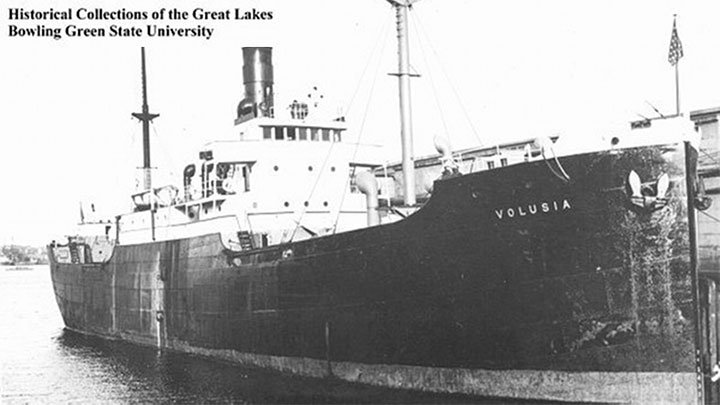
At what (x,y) coordinates should I click in order to perform the action: click on chimney. Please return your answer as a coordinate pair (x, y). This screenshot has height=405, width=720. Looking at the image, I should click on pyautogui.click(x=258, y=75).